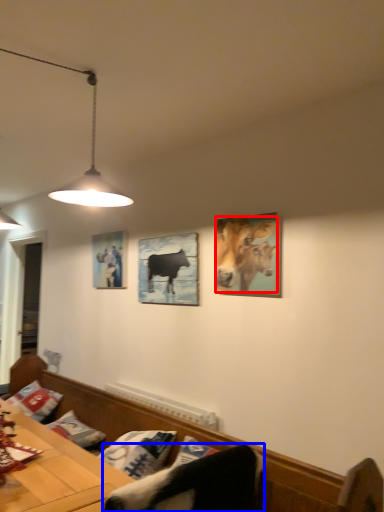
Question: Which object is further to the camera taking this photo, cattle (highlighted by a red box) or swivel chair (highlighted by a blue box)?

Choices:
 (A) cattle
 (B) swivel chair

Answer: (A)